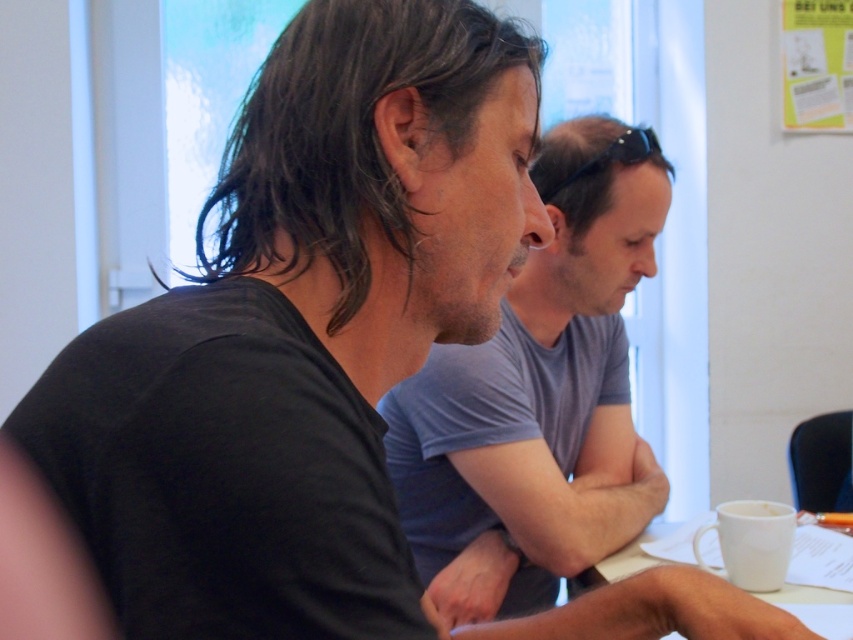
Question: Is matte black shirt at center bigger than white ceramic mug at lower right?

Choices:
 (A) no
 (B) yes

Answer: (B)

Question: Which object is farther from the camera taking this photo?

Choices:
 (A) matte black shirt at center
 (B) white ceramic mug at lower right

Answer: (A)

Question: Which object is closer to the camera taking this photo?

Choices:
 (A) dark brown wavy hair at center
 (B) white ceramic mug at lower right
 (C) dark brown hair at upper right
 (D) matte black shirt at center

Answer: (A)

Question: Observing the image, what is the correct spatial positioning of matte black shirt at center in reference to dark brown wavy hair at center?

Choices:
 (A) right
 (B) left

Answer: (A)

Question: Among these objects, which one is nearest to the camera?

Choices:
 (A) matte black shirt at center
 (B) dark brown hair at upper right
 (C) white ceramic mug at lower right

Answer: (C)

Question: Can you confirm if matte black shirt at center is positioned to the left of dark brown hair at upper right?

Choices:
 (A) yes
 (B) no

Answer: (A)